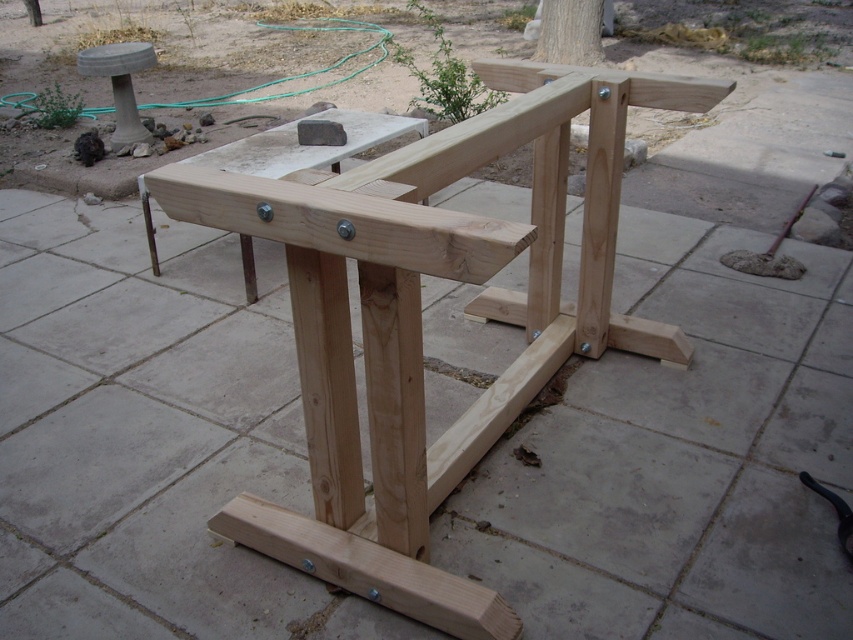
You are setting up a garden display and need to place a tall potted plant. Which object, the natural wood frame at center or the smooth concrete stool at upper left, would be a better choice for stability if the plant is taller than both?

The natural wood frame at center is taller than the smooth concrete stool at upper left, so it would provide better stability for a tall potted plant since it can accommodate the plant height without tipping over.

You are setting up a garden display and need to place a potted plant on the natural wood frame at center. However, you also have a decorative item to place on the smooth concrete stool at upper left. Based on their positions, which object is higher up and thus more suitable for displaying items that need to be seen from a distance?

The smooth concrete stool at upper left is higher up than the natural wood frame at center, making it more suitable for displaying items that need to be seen from a distance.

You are standing at the back of the patio and want to place a potted plant on the natural wood frame at center. Can you see the smooth concrete stool at upper left from your current position?

The natural wood frame at center is in front of the smooth concrete stool at upper left, so you cannot see the smooth concrete stool at upper left from your current position because it is blocked by the natural wood frame at center.